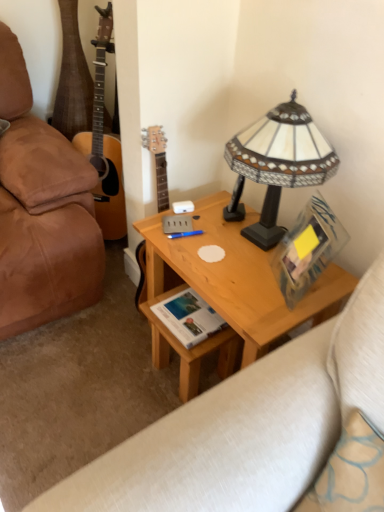
At what (x,y) coordinates should I click in order to perform the action: click on empty space that is ontop of leather studio couch at lower left (from a real-world perspective). Please return your answer as a coordinate pair (x, y). Looking at the image, I should click on (81, 357).